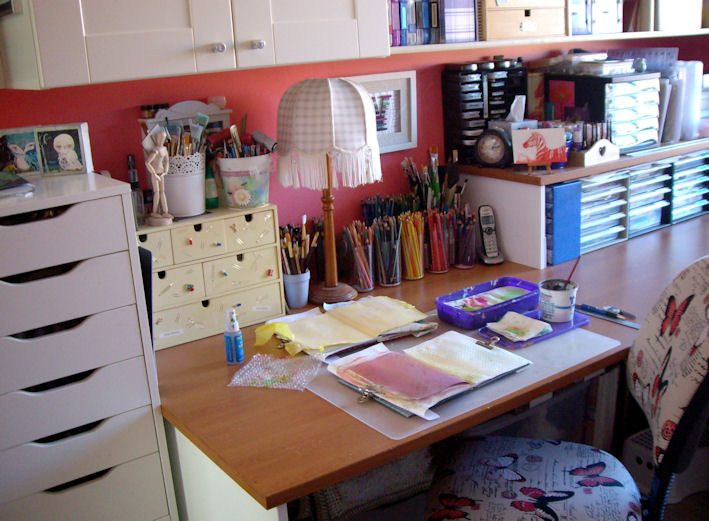
This screenshot has height=521, width=709. I want to click on cupboard, so click(218, 16).